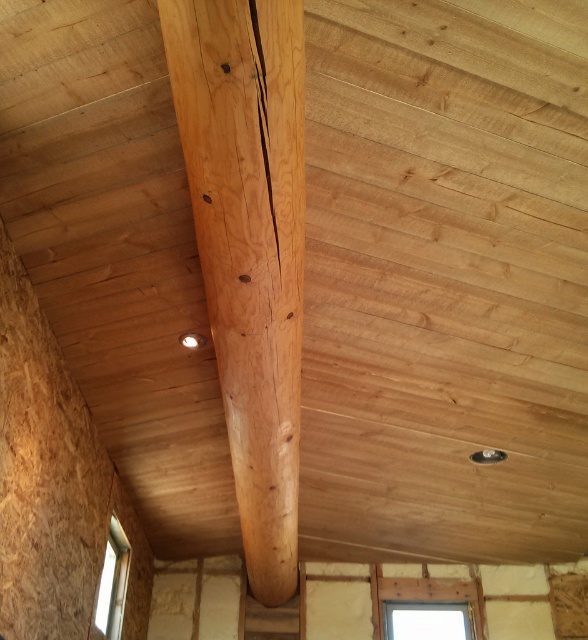
Question: Among these objects, which one is farthest from the camera?

Choices:
 (A) clear glass window at center
 (B) clear glass window at lower left
 (C) natural wood beam at center

Answer: (A)

Question: Is clear glass window at center positioned in front of clear glass window at lower left?

Choices:
 (A) yes
 (B) no

Answer: (B)

Question: Can you confirm if natural wood beam at center is thinner than clear glass window at lower left?

Choices:
 (A) yes
 (B) no

Answer: (B)

Question: Is natural wood beam at center to the left of clear glass window at center from the viewer's perspective?

Choices:
 (A) yes
 (B) no

Answer: (A)

Question: Based on their relative distances, which object is farther from the clear glass window at lower left?

Choices:
 (A) clear glass window at center
 (B) natural wood beam at center

Answer: (A)

Question: Based on their relative distances, which object is nearer to the clear glass window at lower left?

Choices:
 (A) clear glass window at center
 (B) natural wood beam at center

Answer: (B)